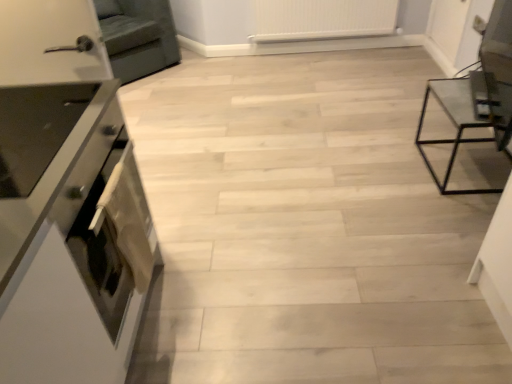
Question: From the image's perspective, is white glossy oven at left over white plastic radiator at upper center?

Choices:
 (A) yes
 (B) no

Answer: (B)

Question: From a real-world perspective, is white glossy oven at left located higher than white plastic radiator at upper center?

Choices:
 (A) no
 (B) yes

Answer: (B)

Question: Is white glossy oven at left behind white plastic radiator at upper center?

Choices:
 (A) yes
 (B) no

Answer: (B)

Question: Is white glossy oven at left far from white plastic radiator at upper center?

Choices:
 (A) no
 (B) yes

Answer: (B)

Question: From the image's perspective, would you say white glossy oven at left is shown under white plastic radiator at upper center?

Choices:
 (A) yes
 (B) no

Answer: (A)

Question: From a real-world perspective, is white glossy oven at left under white plastic radiator at upper center?

Choices:
 (A) yes
 (B) no

Answer: (B)

Question: From the image's perspective, is satin silver oven at left below dark gray fabric armchair at upper left?

Choices:
 (A) no
 (B) yes

Answer: (B)

Question: Is satin silver oven at left in contact with dark gray fabric armchair at upper left?

Choices:
 (A) no
 (B) yes

Answer: (A)

Question: Can you confirm if satin silver oven at left is smaller than dark gray fabric armchair at upper left?

Choices:
 (A) no
 (B) yes

Answer: (B)

Question: Is satin silver oven at left bigger than dark gray fabric armchair at upper left?

Choices:
 (A) yes
 (B) no

Answer: (B)

Question: Is satin silver oven at left to the right of dark gray fabric armchair at upper left from the viewer's perspective?

Choices:
 (A) yes
 (B) no

Answer: (A)

Question: From a real-world perspective, is satin silver oven at left under dark gray fabric armchair at upper left?

Choices:
 (A) yes
 (B) no

Answer: (B)

Question: Does transparent glass table at right have a larger size compared to white plastic radiator at upper center?

Choices:
 (A) yes
 (B) no

Answer: (A)